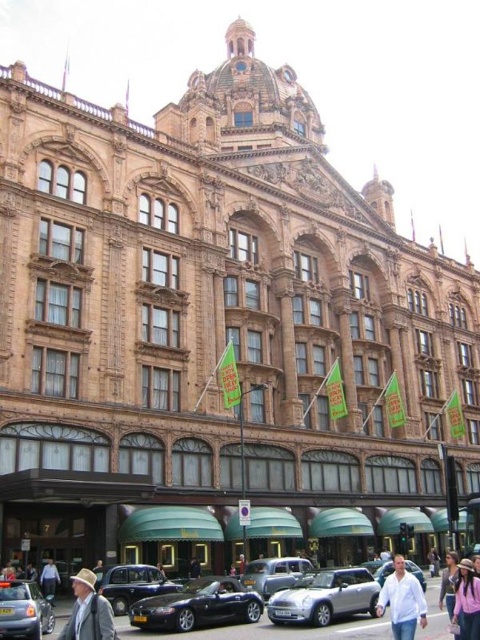
Question: Is silver metallic car at center wider than white cotton shirt at lower right?

Choices:
 (A) no
 (B) yes

Answer: (A)

Question: Does light brown leather hat at lower left have a larger size compared to blue denim jeans at lower left?

Choices:
 (A) no
 (B) yes

Answer: (B)

Question: Which object is closer to the camera taking this photo?

Choices:
 (A) shiny black convertible at lower center
 (B) silver metallic car at center

Answer: (A)

Question: Does silver metallic car at center have a lesser width compared to blue denim jeans at lower left?

Choices:
 (A) no
 (B) yes

Answer: (A)

Question: Which point appears farthest from the camera in this image?

Choices:
 (A) (338, 570)
 (B) (400, 628)
 (C) (194, 564)
 (D) (79, 634)

Answer: (C)

Question: Which point is farther from the camera taking this photo?

Choices:
 (A) (124, 570)
 (B) (156, 566)
 (C) (307, 602)

Answer: (B)